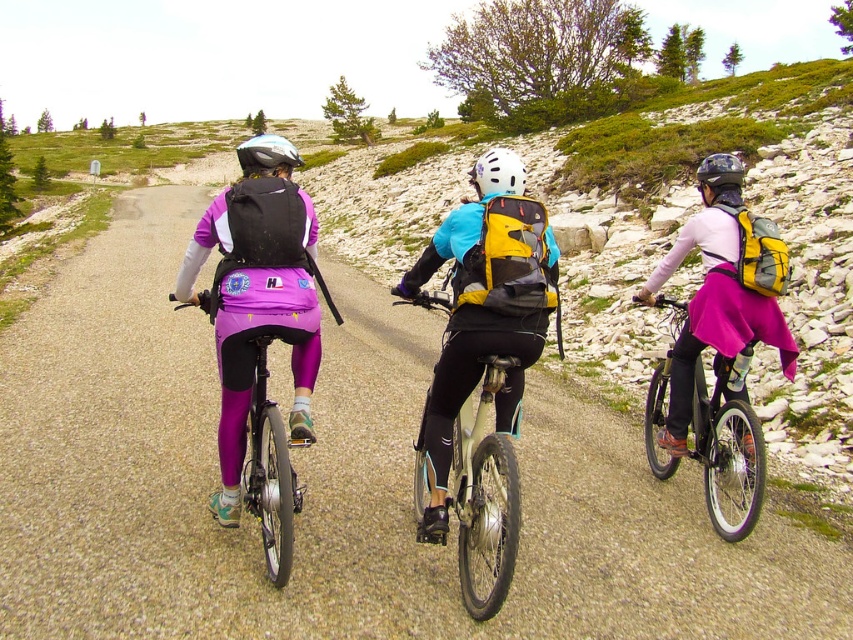
Between point (476, 612) and point (740, 404), which one is positioned in front?

Positioned in front is point (476, 612).

Measure the distance from metallic silver bicycle at center to metallic silver bicycle at right.

metallic silver bicycle at center and metallic silver bicycle at right are 5.96 feet apart from each other.

Is point (457, 440) closer to camera compared to point (653, 442)?

Yes, point (457, 440) is in front of point (653, 442).

What are the coordinates of `metallic silver bicycle at center` in the screenshot? It's located at (485, 497).

Can you confirm if matte black bicycle at center is taller than pink fabric skirt at center?

Correct, matte black bicycle at center is much taller as pink fabric skirt at center.

Does matte black bicycle at center have a lesser width compared to pink fabric skirt at center?

Incorrect, matte black bicycle at center's width is not less than pink fabric skirt at center's.

Who is more forward, (137, 552) or (743, 394)?

Point (137, 552)

The height and width of the screenshot is (640, 853). Find the location of `matte black bicycle at center`. matte black bicycle at center is located at coordinates (335, 484).

Measure the distance between matte black backpack at center and camera.

matte black backpack at center is 3.61 meters away from camera.

What do you see at coordinates (257, 305) in the screenshot?
I see `matte black backpack at center` at bounding box center [257, 305].

This screenshot has height=640, width=853. I want to click on matte black backpack at center, so point(257,305).